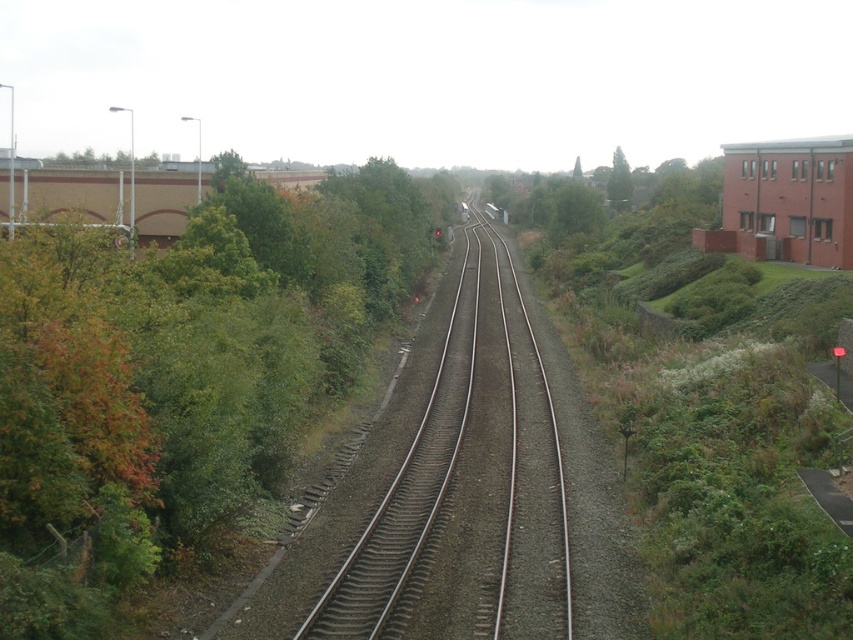
Is green leafy tree at left taller than smooth asphalt train track at center?

Indeed, green leafy tree at left has a greater height compared to smooth asphalt train track at center.

Who is taller, green leafy tree at left or smooth asphalt train track at center?

green leafy tree at left is taller.

Does point (91, 528) come in front of point (392, 621)?

That is True.

I want to click on green leafy tree at left, so click(178, 378).

Is smooth asphalt train track at center further to camera compared to green leafy tree at upper center?

No, smooth asphalt train track at center is closer to the viewer.

Does point (511, 266) come closer to viewer compared to point (618, 209)?

Yes, it is in front of point (618, 209).

The image size is (853, 640). What are the coordinates of `smooth asphalt train track at center` in the screenshot? It's located at (456, 476).

Between green leafy tree at left and green leafy tree at upper center, which one is positioned higher?

green leafy tree at upper center is higher up.

Is green leafy tree at left to the right of green leafy tree at upper center from the viewer's perspective?

No, green leafy tree at left is not to the right of green leafy tree at upper center.

Is point (221, 248) positioned before point (630, 198)?

Yes.

You are a GUI agent. You are given a task and a screenshot of the screen. Output one action in this format:
    pyautogui.click(x=<x>, y=<y>)
    Task: Click on the green leafy tree at left
    This screenshot has height=640, width=853.
    Given the screenshot: What is the action you would take?
    pyautogui.click(x=178, y=378)